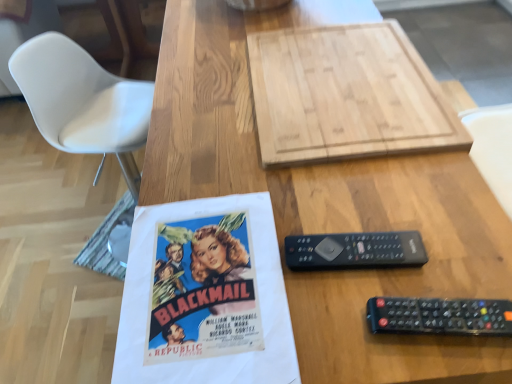
In order to click on unoccupied space behind black plastic remote at lower right in this screenshot , I will do `click(398, 225)`.